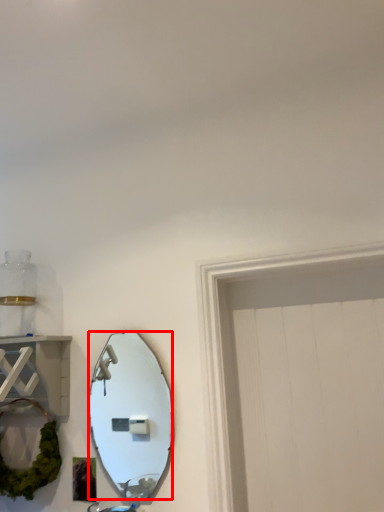
Question: Observing the image, what is the correct spatial positioning of mirror (annotated by the red box) in reference to cabinet?

Choices:
 (A) right
 (B) left

Answer: (A)